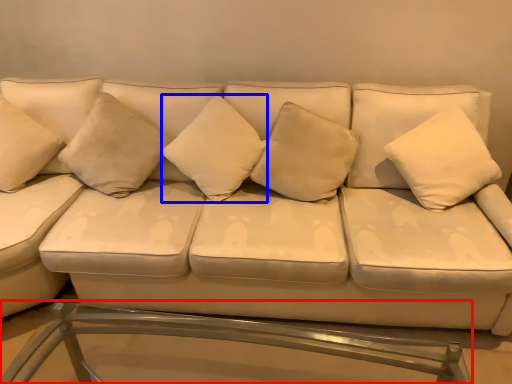
Question: Which point is further to the camera, table (highlighted by a red box) or pillow (highlighted by a blue box)?

Choices:
 (A) table
 (B) pillow

Answer: (B)